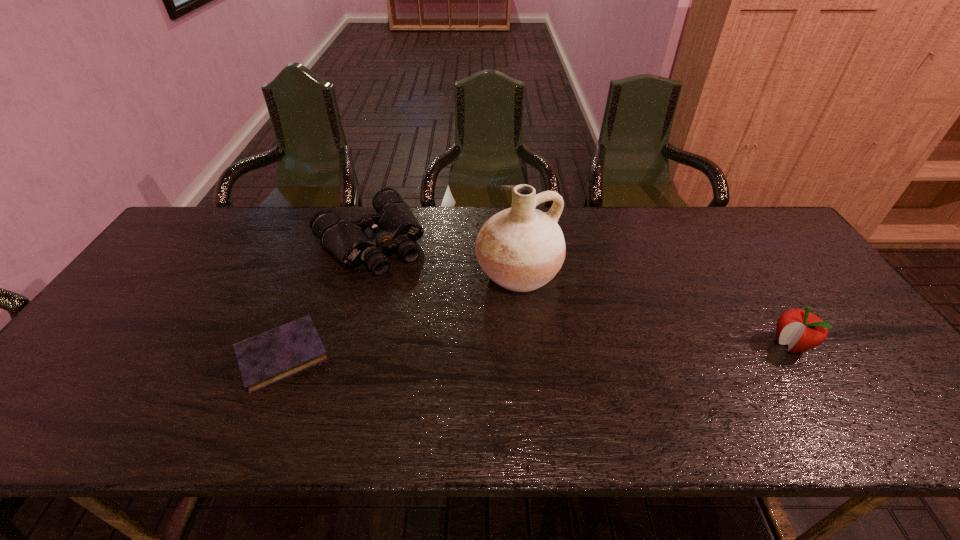
In the image, there is a desktop. What are the coordinates of `vacant space at the left edge` in the screenshot? It's located at (187, 288).

The width and height of the screenshot is (960, 540). I want to click on free region at the far right corner, so click(x=783, y=251).

You are a GUI agent. You are given a task and a screenshot of the screen. Output one action in this format:
    pyautogui.click(x=<x>, y=<y>)
    Task: Click on the vacant space at the near right corner of the desktop
    The height and width of the screenshot is (540, 960).
    Given the screenshot: What is the action you would take?
    [880, 390]

Locate an element on the screen. The image size is (960, 540). unoccupied position between the third tallest object and the apple is located at coordinates (580, 293).

Locate an element on the screen. This screenshot has height=540, width=960. vacant area that lies between the shortest object and the binoculars is located at coordinates (326, 298).

Locate an element on the screen. vacant space in between the pottery and the diary is located at coordinates (400, 314).

This screenshot has height=540, width=960. I want to click on vacant area between the apple and the shortest object, so click(537, 350).

You are a GUI agent. You are given a task and a screenshot of the screen. Output one action in this format:
    pyautogui.click(x=<x>, y=<y>)
    Task: Click on the empty location between the second tallest object and the tallest object
    The image size is (960, 540).
    Given the screenshot: What is the action you would take?
    pyautogui.click(x=654, y=309)

Locate an element on the screen. The height and width of the screenshot is (540, 960). free spot between the pottery and the shortest object is located at coordinates (400, 314).

At what (x,y) coordinates should I click in order to perform the action: click on free space that is in between the shortest object and the second tallest object. Please return your answer as a coordinate pair (x, y). The image size is (960, 540). Looking at the image, I should click on (537, 350).